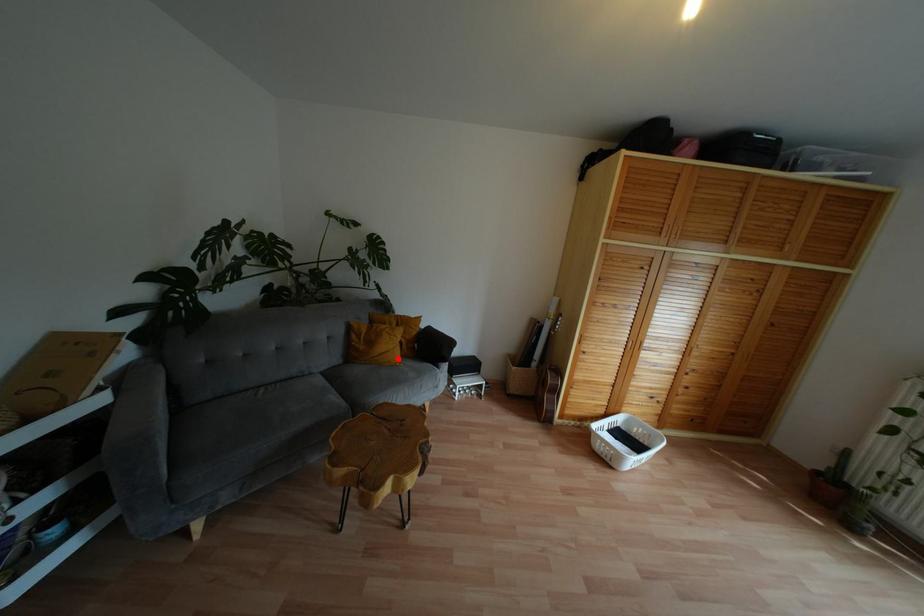
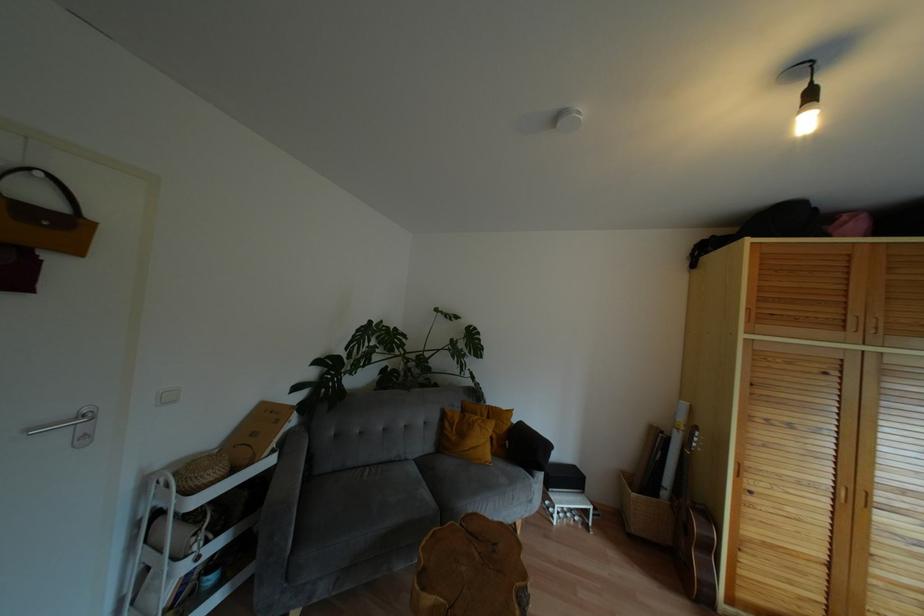
Find the pixel in the second image that matches the highlighted location in the first image.

(488, 456)